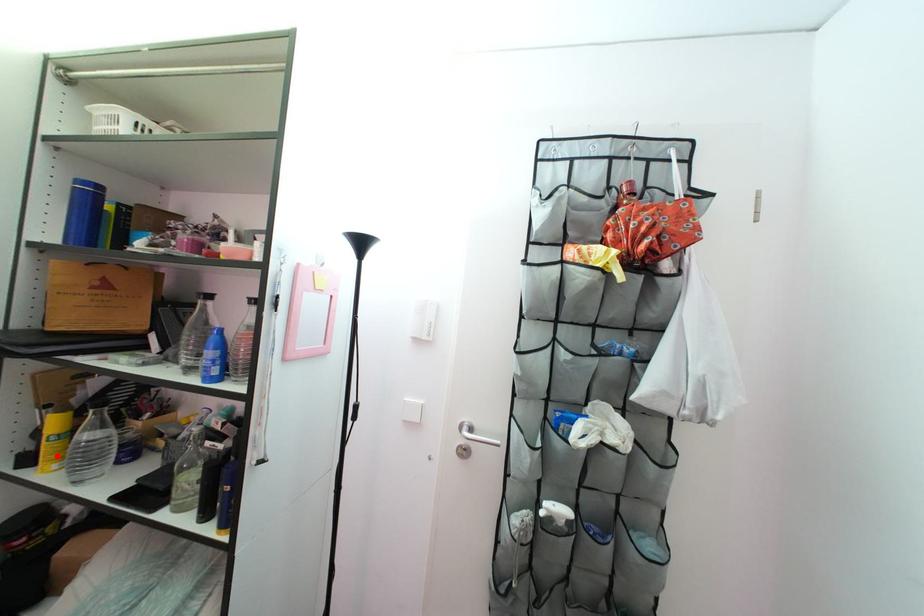
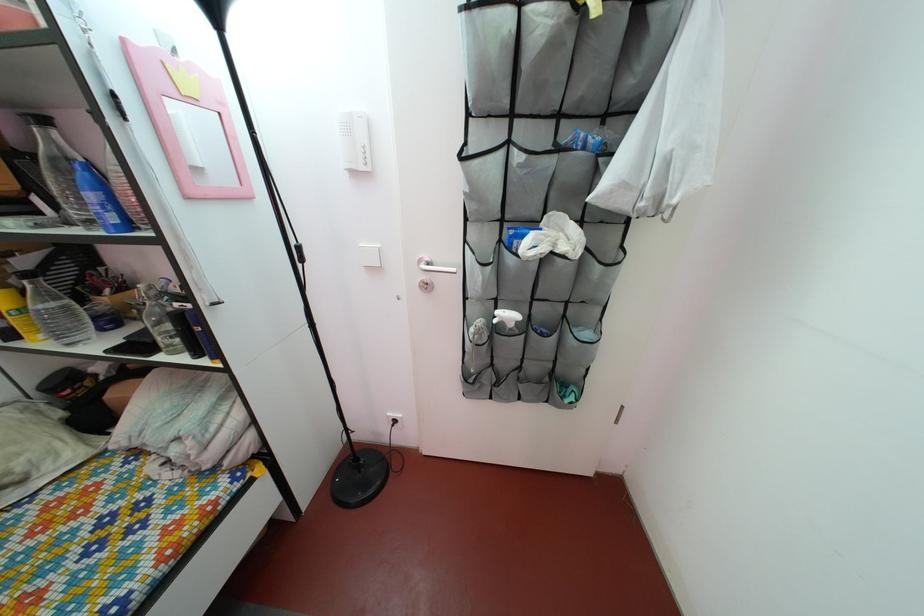
Find the pixel in the second image that matches the highlighted location in the first image.

(27, 330)